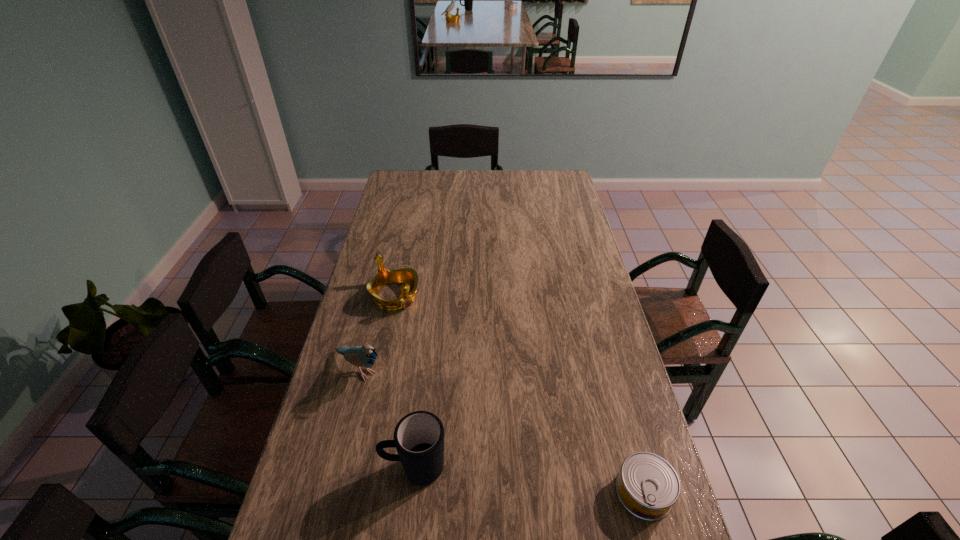
You are a GUI agent. You are given a task and a screenshot of the screen. Output one action in this format:
    pyautogui.click(x=<x>, y=<y>)
    Task: Click on the free space on the desktop that is between the mug and the can and is positioned at the face of the third nearest object
    The image size is (960, 540).
    Given the screenshot: What is the action you would take?
    pyautogui.click(x=493, y=476)

You are a GUI agent. You are given a task and a screenshot of the screen. Output one action in this format:
    pyautogui.click(x=<x>, y=<y>)
    Task: Click on the vacant space on the desktop that is between the mug and the shortest object and is positioned at the front emblem of the farthest object
    This screenshot has height=540, width=960.
    Given the screenshot: What is the action you would take?
    click(x=557, y=483)